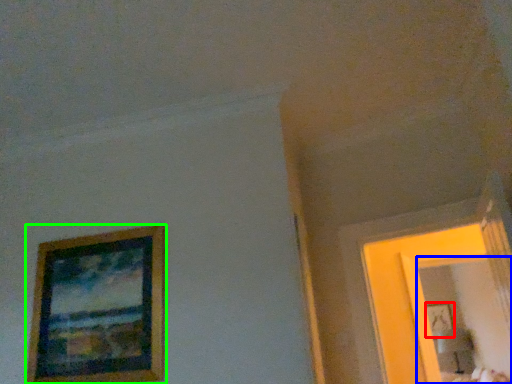
Question: Considering the real-world distances, which object is farthest from picture frame (highlighted by a red box)? mirror (highlighted by a blue box) or picture frame (highlighted by a green box)?

Choices:
 (A) mirror
 (B) picture frame

Answer: (B)